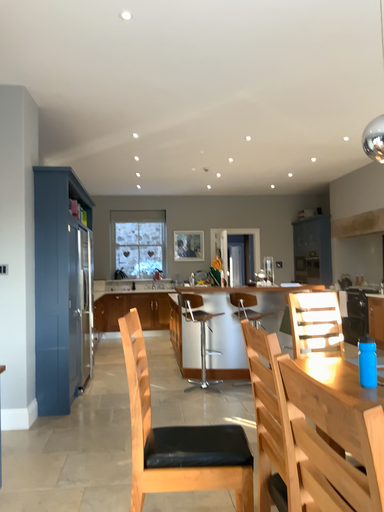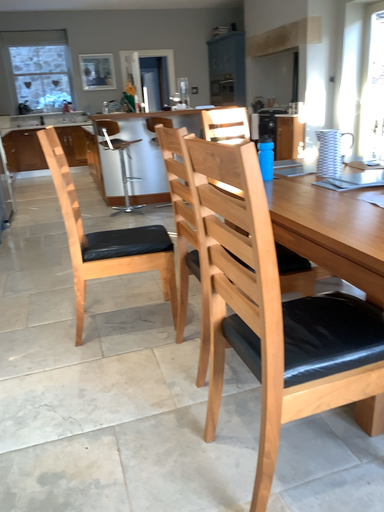
Question: How did the camera likely rotate when shooting the video?

Choices:
 (A) rotated downward
 (B) rotated upward

Answer: (A)